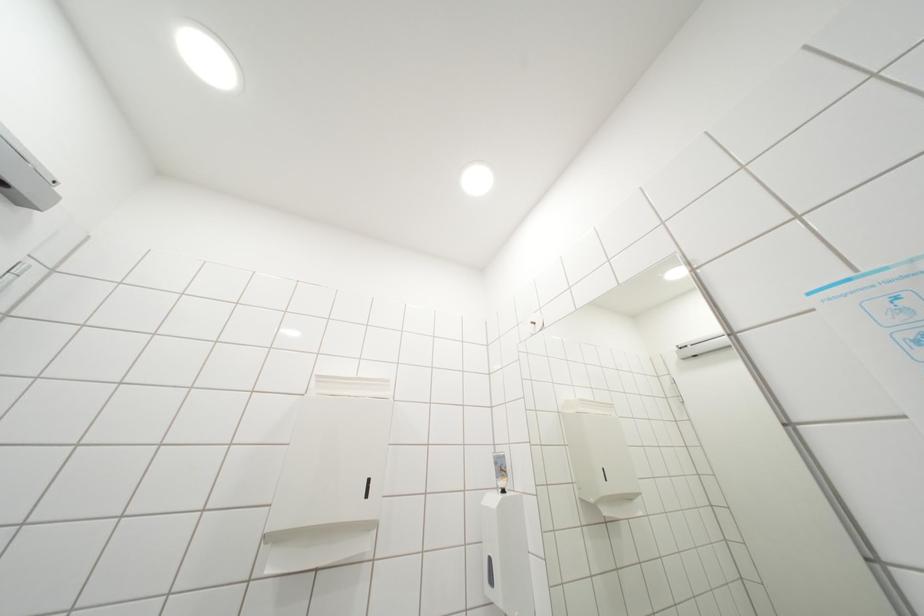
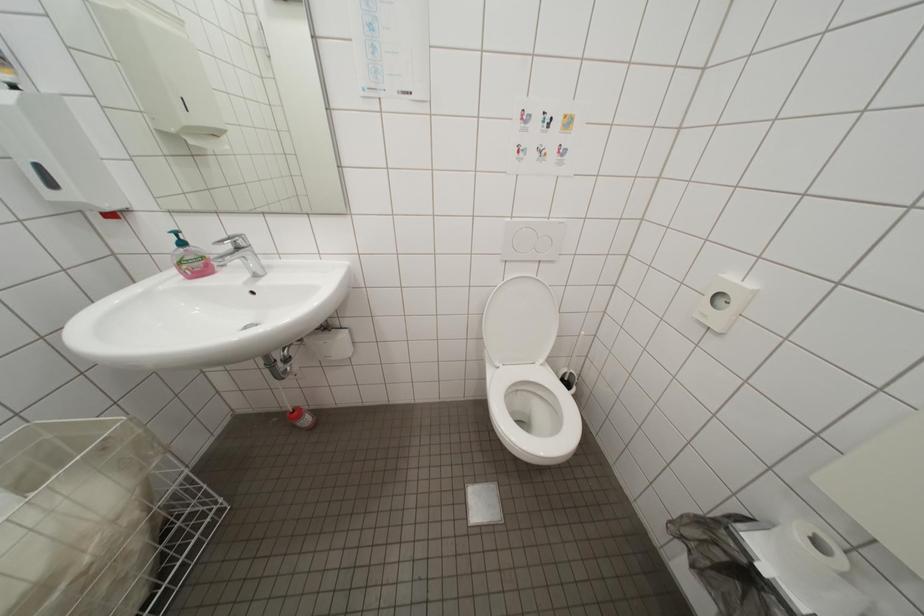
Based on the continuous images, in which direction is the camera rotating?

The camera's rotation is toward right-down.